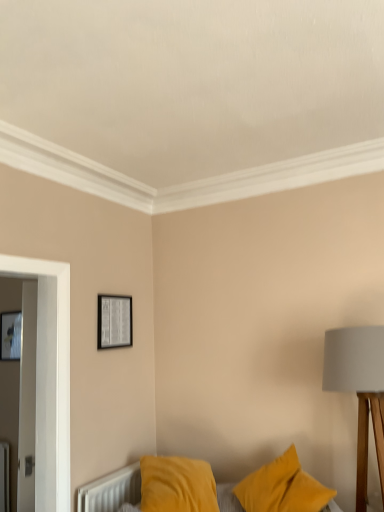
Question: Is matte black picture frame at upper left, which is counted as the 2th picture frame, starting from the front, not within matte black picture frame at upper center, the first picture frame positioned from the right?

Choices:
 (A) yes
 (B) no

Answer: (A)

Question: Is matte black picture frame at upper left, the 2th picture frame viewed from the right, facing away from matte black picture frame at upper center, which is counted as the 2th picture frame, starting from the left?

Choices:
 (A) no
 (B) yes

Answer: (A)

Question: From a real-world perspective, is matte black picture frame at upper left, the 1th picture frame from the left, beneath matte black picture frame at upper center, arranged as the 1th picture frame when viewed from the front?

Choices:
 (A) yes
 (B) no

Answer: (A)

Question: Does matte black picture frame at upper left, the 2th picture frame viewed from the right, have a greater width compared to matte black picture frame at upper center, the second picture frame viewed from the back?

Choices:
 (A) yes
 (B) no

Answer: (A)

Question: Is matte black picture frame at upper left, the first picture frame when ordered from back to front, positioned before matte black picture frame at upper center, the first picture frame positioned from the right?

Choices:
 (A) no
 (B) yes

Answer: (A)

Question: From their relative heights in the image, would you say matte black picture frame at upper center, which is counted as the 2th picture frame, starting from the left, is taller or shorter than velvet yellow pillows at lower center?

Choices:
 (A) tall
 (B) short

Answer: (B)

Question: In the image, is matte black picture frame at upper center, arranged as the 1th picture frame when viewed from the front, positioned in front of or behind velvet yellow pillows at lower center?

Choices:
 (A) front
 (B) behind

Answer: (B)

Question: Looking at their shapes, would you say matte black picture frame at upper center, the first picture frame positioned from the right, is wider or thinner than velvet yellow pillows at lower center?

Choices:
 (A) wide
 (B) thin

Answer: (B)

Question: Considering the positions of matte black picture frame at upper center, which is counted as the 2th picture frame, starting from the left, and velvet yellow pillows at lower center in the image, is matte black picture frame at upper center, which is counted as the 2th picture frame, starting from the left, bigger or smaller than velvet yellow pillows at lower center?

Choices:
 (A) small
 (B) big

Answer: (A)

Question: Considering the positions of matte gray fabric lampshade at right and matte black picture frame at upper left, the first picture frame when ordered from back to front, in the image, is matte gray fabric lampshade at right wider or thinner than matte black picture frame at upper left, the first picture frame when ordered from back to front,?

Choices:
 (A) wide
 (B) thin

Answer: (A)

Question: Choose the correct answer: Is matte gray fabric lampshade at right inside matte black picture frame at upper left, the 1th picture frame from the left, or outside it?

Choices:
 (A) outside
 (B) inside

Answer: (A)

Question: From a real-world perspective, relative to matte black picture frame at upper left, which is counted as the 2th picture frame, starting from the front, is matte gray fabric lampshade at right vertically above or below?

Choices:
 (A) below
 (B) above

Answer: (A)

Question: Is matte gray fabric lampshade at right in front of or behind matte black picture frame at upper left, the first picture frame when ordered from back to front, in the image?

Choices:
 (A) front
 (B) behind

Answer: (A)

Question: Considering their positions, is matte gray fabric lampshade at right located in front of or behind matte black picture frame at upper center, the first picture frame positioned from the right?

Choices:
 (A) front
 (B) behind

Answer: (A)

Question: Considering the positions of matte gray fabric lampshade at right and matte black picture frame at upper center, the second picture frame viewed from the back, in the image, is matte gray fabric lampshade at right bigger or smaller than matte black picture frame at upper center, the second picture frame viewed from the back,?

Choices:
 (A) big
 (B) small

Answer: (A)